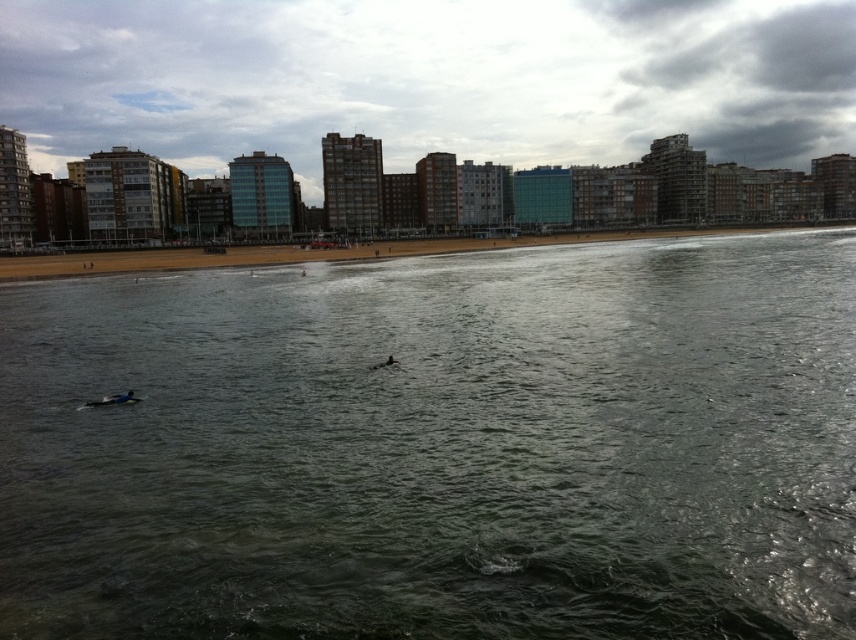
Question: Can you confirm if dark green water at center is positioned to the left of brown sand at lower center?

Choices:
 (A) no
 (B) yes

Answer: (B)

Question: Which object is closer to the camera taking this photo?

Choices:
 (A) dark green water at center
 (B) brown sand at lower center

Answer: (A)

Question: Does dark green water at center appear under brown sand at lower center?

Choices:
 (A) no
 (B) yes

Answer: (B)

Question: Which of the following is the closest to the observer?

Choices:
 (A) (467, 244)
 (B) (767, 600)

Answer: (B)

Question: Considering the relative positions of dark green water at center and brown sand at lower center in the image provided, where is dark green water at center located with respect to brown sand at lower center?

Choices:
 (A) above
 (B) below

Answer: (B)

Question: Which point is farther to the camera?

Choices:
 (A) (551, 484)
 (B) (117, 268)

Answer: (B)